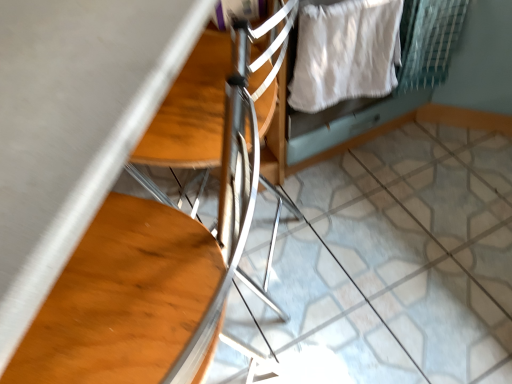
Question: Should I look upward or downward to see white cotton sheet at upper right?

Choices:
 (A) down
 (B) up

Answer: (B)